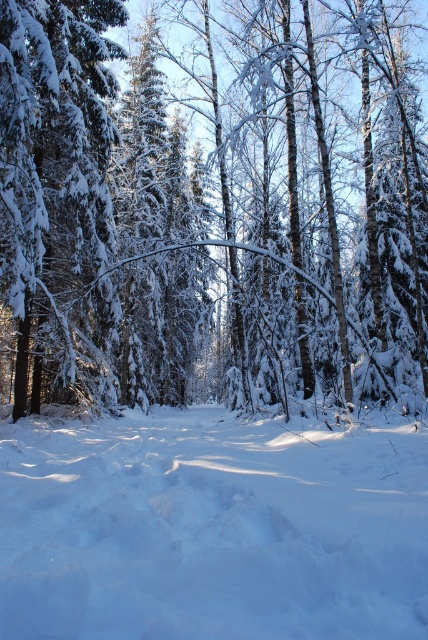
Is white snow-covered tree at center further to camera compared to white fluffy snow at center?

Yes.

Between white snow-covered tree at center and white fluffy snow at center, which one has less height?

Standing shorter between the two is white fluffy snow at center.

Find the location of `white snow-covered tree at center`. white snow-covered tree at center is located at coordinates (211, 204).

At what (x,y) coordinates should I click in order to perform the action: click on white snow-covered tree at center. Please return your answer as a coordinate pair (x, y). Looking at the image, I should click on (211, 204).